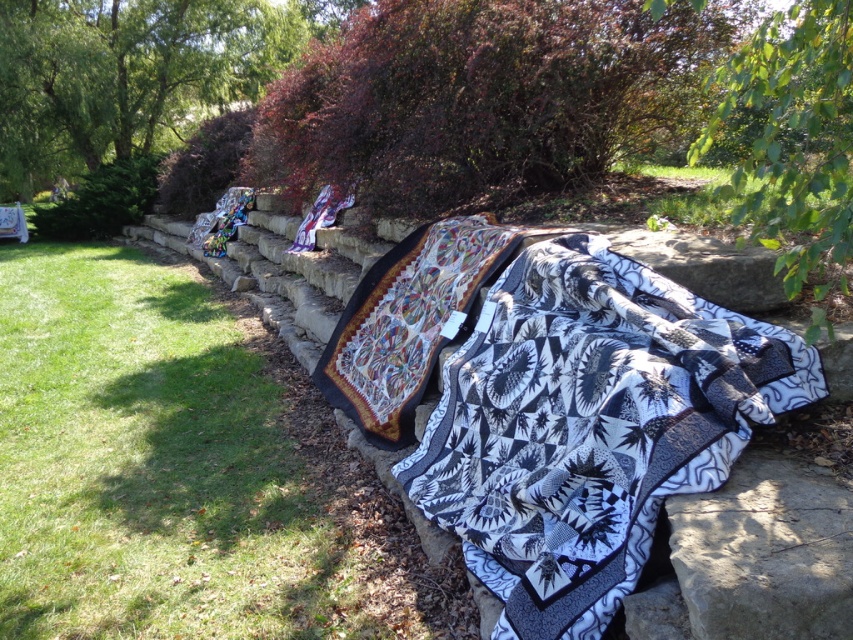
You are standing in front of the stone wall with quilts displayed. You notice the black quilt at center and the green leafy tree at upper right. Which object is closer to you?

The black quilt at center is closer to you because it is further to the viewer than the green leafy tree at upper right.

You are a photographer wanting to capture the black quilt at center and the purple leafy bush at upper center in the same frame. Based on their sizes, which object would appear larger in the photo?

The black quilt at center would appear larger in the photo because it is much taller than the purple leafy bush at upper center.